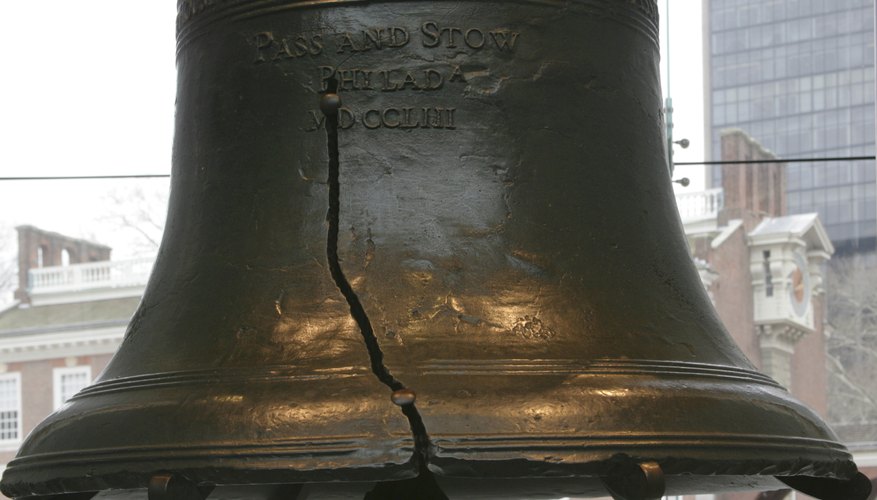
Find the location of a particular element. cable is located at coordinates (753, 161).